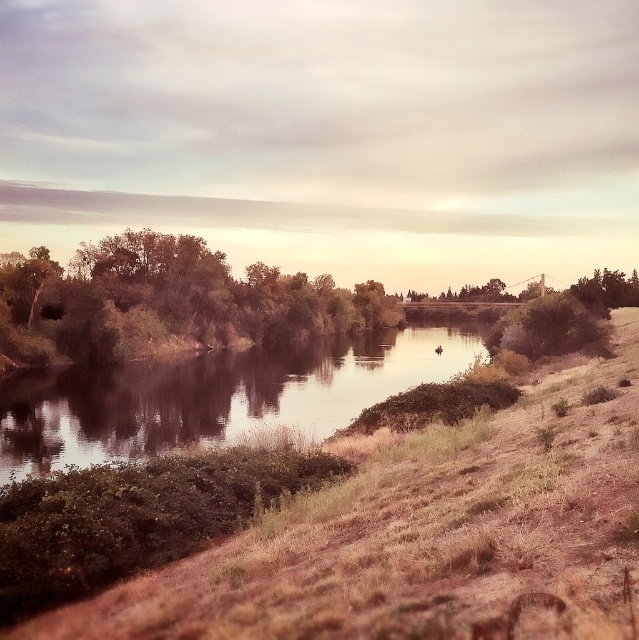
Question: In this image, where is smooth reflective water at center located relative to green leafy tree at right?

Choices:
 (A) above
 (B) below

Answer: (B)

Question: Is smooth reflective water at center positioned behind green leafy bush at right?

Choices:
 (A) yes
 (B) no

Answer: (B)

Question: Does brown grassy hillside at lower left have a greater width compared to smooth reflective water at center?

Choices:
 (A) no
 (B) yes

Answer: (A)

Question: Which point is farther from the camera taking this photo?

Choices:
 (A) (104, 624)
 (B) (88, 323)
 (C) (619, 269)
 (D) (183, 436)

Answer: (C)

Question: Which object is positioned closest to the green leafy trees at left?

Choices:
 (A) brown grassy hillside at lower left
 (B) green leafy bush at right
 (C) smooth reflective water at center
 (D) green leafy tree at right

Answer: (C)

Question: Considering the real-world distances, which object is farthest from the green leafy bush at right?

Choices:
 (A) brown grassy hillside at lower left
 (B) green leafy trees at left
 (C) smooth reflective water at center
 (D) green leafy tree at right

Answer: (A)